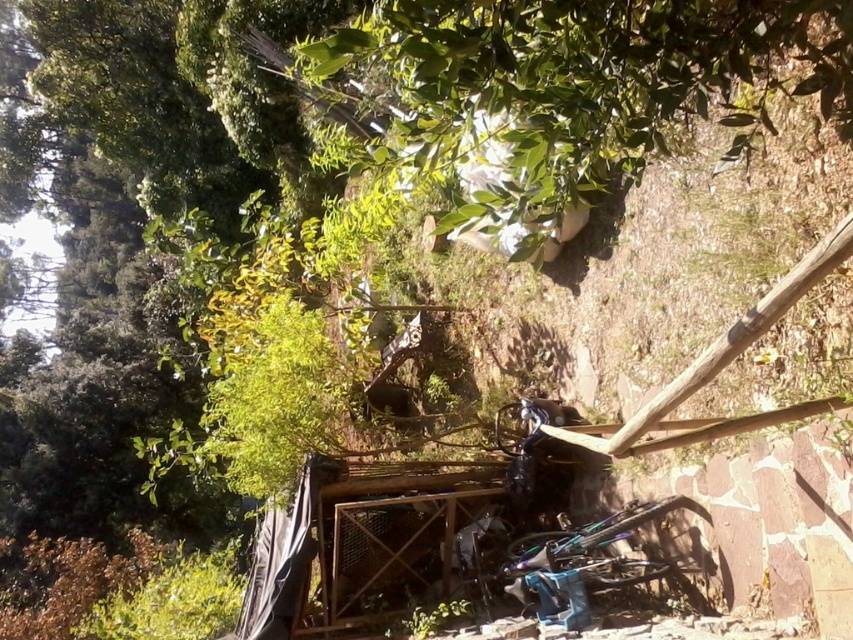
You are standing in the garden and want to locate the green leafy tree at upper center. According to the coordinates provided, where should you look?

The green leafy tree at upper center is located at coordinates point (566, 93).

You are planning to set up a picnic in this garden. You need to choose a spot that is under the green leafy tree at upper center but away from the shiny metallic bicycle at center. Is the area under the tree large enough to accommodate your picnic blanket without being too close to the bicycle?

The green leafy tree at upper center is bigger than the shiny metallic bicycle at center, so the area under the tree is likely large enough to place the picnic blanket away from the bicycle.